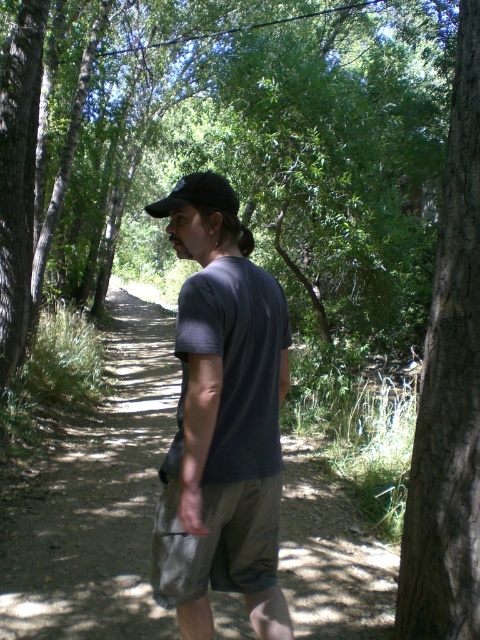
You are a hiker trying to follow the dirt path at center. There is a brown rough bark tree at right nearby. Which direction should you walk to stay on the path?

The dirt path at center is positioned under the brown rough bark tree at right, so you should walk towards the tree to stay on the path.